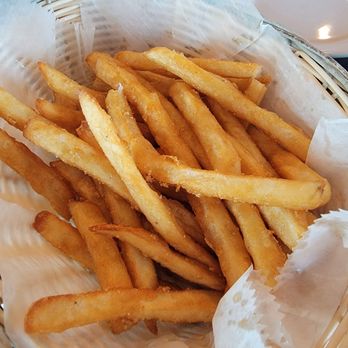
Identify the location of basket. This screenshot has width=348, height=348. (321, 54).